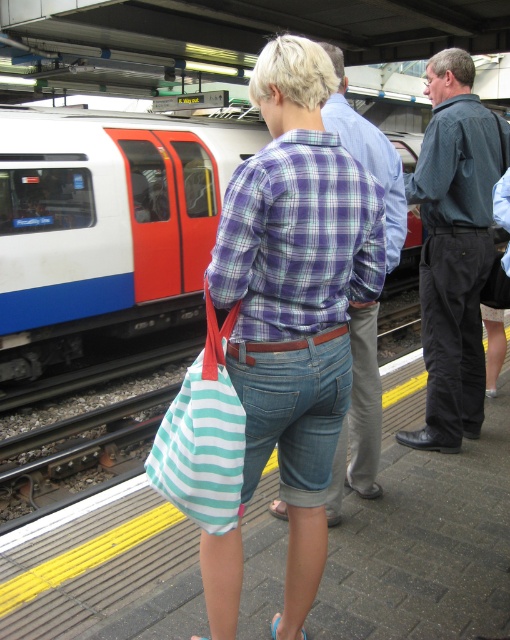
Question: Does striped fabric bag at center come behind plaid shirt at center?

Choices:
 (A) yes
 (B) no

Answer: (B)

Question: Which of these objects is positioned farthest from the dark blue shirt at center?

Choices:
 (A) striped fabric bag at center
 (B) white glossy train at upper left
 (C) plaid shirt at center
 (D) teal striped fabric bag at center

Answer: (B)

Question: Can you confirm if striped fabric bag at center is positioned to the right of white glossy train at upper left?

Choices:
 (A) no
 (B) yes

Answer: (B)

Question: Considering the real-world distances, which object is farthest from the dark blue shirt at center?

Choices:
 (A) striped fabric bag at center
 (B) plaid shirt at center
 (C) white glossy train at upper left

Answer: (C)

Question: Which object is the closest to the white glossy train at upper left?

Choices:
 (A) plaid shirt at center
 (B) striped fabric bag at center

Answer: (A)

Question: Is the position of striped fabric bag at center more distant than that of plaid shirt at center?

Choices:
 (A) no
 (B) yes

Answer: (A)